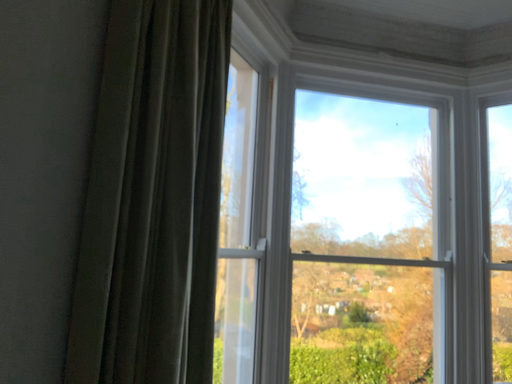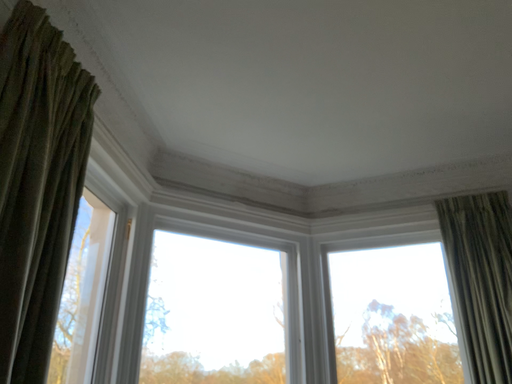
Question: Which way did the camera rotate in the video?

Choices:
 (A) rotated left
 (B) rotated right

Answer: (B)